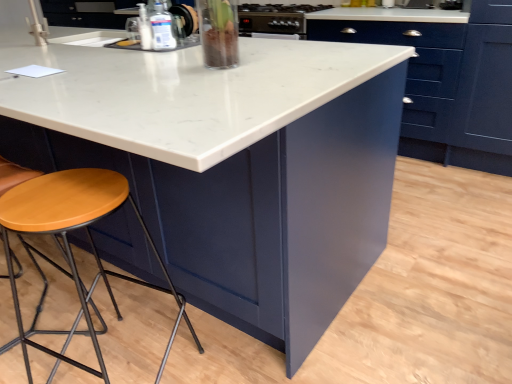
At what (x,y) coordinates should I click in order to perform the action: click on wooden seat at lower left. Please return your answer as a coordinate pair (x, y). The height and width of the screenshot is (384, 512). Looking at the image, I should click on (56, 199).

Identify the location of metallic stainless steel oven at upper center, the 2th appliance ordered from the bottom. (275, 18).

Find the location of a particular element. Image resolution: width=512 pixels, height=384 pixels. clear glass vase at upper center, the 1th appliance in the bottom-to-top sequence is located at coordinates (218, 32).

Describe the element at coordinates (162, 27) in the screenshot. I see `clear plastic bottle at upper center` at that location.

Measure the distance between matte blue cabinet at center and camera.

They are 2.21 meters apart.

Measure the distance between wooden seat stool at lower left and camera.

wooden seat stool at lower left and camera are 37.32 inches apart.

Where is `wooden seat at lower left`? The image size is (512, 384). wooden seat at lower left is located at coordinates (56, 199).

Is matte blue cabinet at center positioned before metallic stainless steel oven at upper center, positioned as the 2th appliance in front-to-back order?

Yes.

Which point is more forward, [349,9] or [241,14]?

The point [349,9] is closer to the camera.

You are a GUI agent. You are given a task and a screenshot of the screen. Output one action in this format:
    pyautogui.click(x=<x>, y=<y>)
    Task: Click on the cabinetry on the right of metallic stainless steel oven at upper center, the second appliance in the left-to-right sequence
    The image size is (512, 384).
    Given the screenshot: What is the action you would take?
    pyautogui.click(x=444, y=78)

How many degrees apart are the facing directions of matte blue cabinet at center and metallic stainless steel oven at upper center, acting as the first appliance starting from the back?

They differ by 0.647 degrees in their facing directions.

In the scene shown: Between clear glass vase at upper center, the second appliance positioned from the top, and clear plastic bottle at upper center, which one has smaller width?

clear plastic bottle at upper center.

Does clear glass vase at upper center, which is the 2th appliance in back-to-front order, have a greater height compared to clear plastic bottle at upper center?

Correct, clear glass vase at upper center, which is the 2th appliance in back-to-front order, is much taller as clear plastic bottle at upper center.

In order to click on appliance above the clear plastic bottle at upper center (from a real-world perspective) in this screenshot , I will do `click(218, 32)`.

Considering the relative sizes of clear glass vase at upper center, acting as the first appliance starting from the left, and clear plastic bottle at upper center in the image provided, is clear glass vase at upper center, acting as the first appliance starting from the left, smaller than clear plastic bottle at upper center?

Actually, clear glass vase at upper center, acting as the first appliance starting from the left, might be larger than clear plastic bottle at upper center.

Which is closer to the camera, (x=234, y=29) or (x=39, y=183)?

The point (x=39, y=183) is closer to the camera.

From a real-world perspective, is clear glass vase at upper center, the second appliance positioned from the top, physically below wooden seat stool at lower left?

Incorrect, from a real-world perspective, clear glass vase at upper center, the second appliance positioned from the top, is higher than wooden seat stool at lower left.

Which of these two, clear glass vase at upper center, the second appliance positioned from the top, or wooden seat stool at lower left, is wider?

With larger width is wooden seat stool at lower left.

Is wooden seat stool at lower left at the back of clear glass vase at upper center, the second appliance positioned from the top?

No.

In terms of size, does clear plastic bottle at upper center appear bigger or smaller than wooden seat at lower left?

In the image, clear plastic bottle at upper center appears to be smaller than wooden seat at lower left.

Which object is thinner, clear plastic bottle at upper center or wooden seat at lower left?

Thinner between the two is clear plastic bottle at upper center.

From the image's perspective, is clear plastic bottle at upper center above or below wooden seat at lower left?

clear plastic bottle at upper center is situated higher than wooden seat at lower left in the image.

Is clear plastic bottle at upper center outside of wooden seat at lower left?

clear plastic bottle at upper center is positioned outside wooden seat at lower left.

Which is more to the right, wooden seat stool at lower left or clear plastic bottle at upper center?

Positioned to the right is clear plastic bottle at upper center.

Based on the photo, based on their sizes in the image, would you say wooden seat stool at lower left is bigger or smaller than clear plastic bottle at upper center?

wooden seat stool at lower left is bigger than clear plastic bottle at upper center.

Is wooden seat stool at lower left far from clear plastic bottle at upper center?

No, wooden seat stool at lower left is in close proximity to clear plastic bottle at upper center.

From a real-world perspective, who is located lower, wooden seat stool at lower left or clear plastic bottle at upper center?

wooden seat stool at lower left is physically lower.

Is wooden seat at lower left to the left or to the right of matte blue cabinet at center in the image?

wooden seat at lower left is to the left of matte blue cabinet at center.

Is there a large distance between wooden seat at lower left and matte blue cabinet at center?

Yes.

Does point (31, 183) appear closer or farther from the camera than point (484, 43)?

Point (31, 183).

Measure the distance between wooden seat at lower left and matte blue cabinet at center.

A distance of 2.17 meters exists between wooden seat at lower left and matte blue cabinet at center.

Locate an element on the screen. cabinetry above the clear plastic bottle at upper center (from the image's perspective) is located at coordinates (444, 78).

Which is behind, point (157, 35) or point (319, 36)?

The point (319, 36) is behind.

Which object is closer to the camera taking this photo, clear plastic bottle at upper center or matte blue cabinet at center?

clear plastic bottle at upper center is in front.

Locate an element on the screen. cabinetry that appears below the metallic stainless steel oven at upper center, the second appliance in the left-to-right sequence (from a real-world perspective) is located at coordinates (444, 78).

Identify the location of appliance above the clear plastic bottle at upper center (from a real-world perspective). (218, 32).

From the image, which object appears to be farther from metallic stainless steel oven at upper center, acting as the 1th appliance starting from the top, matte blue cabinet at center or wooden seat at lower left?

The object further to metallic stainless steel oven at upper center, acting as the 1th appliance starting from the top, is wooden seat at lower left.

From the image, which object appears to be nearer to metallic stainless steel oven at upper center, the second appliance in the left-to-right sequence, clear glass vase at upper center, the first appliance from the front, or matte blue cabinet at center?

Based on the image, matte blue cabinet at center appears to be nearer to metallic stainless steel oven at upper center, the second appliance in the left-to-right sequence.

Looking at the image, which one is located further to matte blue cabinet at center, metallic stainless steel oven at upper center, the 2th appliance ordered from the bottom, or clear plastic bottle at upper center?

clear plastic bottle at upper center lies further to matte blue cabinet at center than the other object.

Estimate the real-world distances between objects in this image. Which object is closer to wooden seat stool at lower left, wooden seat at lower left or metallic stainless steel oven at upper center, the second appliance in the left-to-right sequence?

wooden seat at lower left is positioned closer to the anchor wooden seat stool at lower left.

Based on their spatial positions, is wooden seat at lower left or matte blue cabinet at center closer to wooden seat stool at lower left?

wooden seat at lower left is positioned closer to the anchor wooden seat stool at lower left.

Estimate the real-world distances between objects in this image. Which object is closer to wooden seat stool at lower left, matte blue cabinet at center or clear plastic bottle at upper center?

clear plastic bottle at upper center.

Looking at the image, which one is located closer to clear glass vase at upper center, which is the 2th appliance in back-to-front order, wooden seat stool at lower left or wooden seat at lower left?

The object closer to clear glass vase at upper center, which is the 2th appliance in back-to-front order, is wooden seat at lower left.

Based on their spatial positions, is wooden seat stool at lower left or clear glass vase at upper center, positioned as the 2th appliance in right-to-left order, closer to wooden seat at lower left?

The object closer to wooden seat at lower left is wooden seat stool at lower left.

Identify the location of chair between clear glass vase at upper center, positioned as the 2th appliance in right-to-left order, and wooden seat stool at lower left in the up-down direction. (56, 199).

The image size is (512, 384). Identify the location of appliance between wooden seat at lower left and metallic stainless steel oven at upper center, acting as the 1th appliance starting from the top, in the front-back direction. (218, 32).

You are a GUI agent. You are given a task and a screenshot of the screen. Output one action in this format:
    pyautogui.click(x=<x>, y=<y>)
    Task: Click on the bottle between wooden seat stool at lower left and matte blue cabinet at center from left to right
    The image size is (512, 384).
    Given the screenshot: What is the action you would take?
    pyautogui.click(x=162, y=27)

At what (x,y) coordinates should I click in order to perform the action: click on appliance between wooden seat stool at lower left and metallic stainless steel oven at upper center, the second appliance in the left-to-right sequence, in the front-back direction. Please return your answer as a coordinate pair (x, y). This screenshot has height=384, width=512. Looking at the image, I should click on click(218, 32).